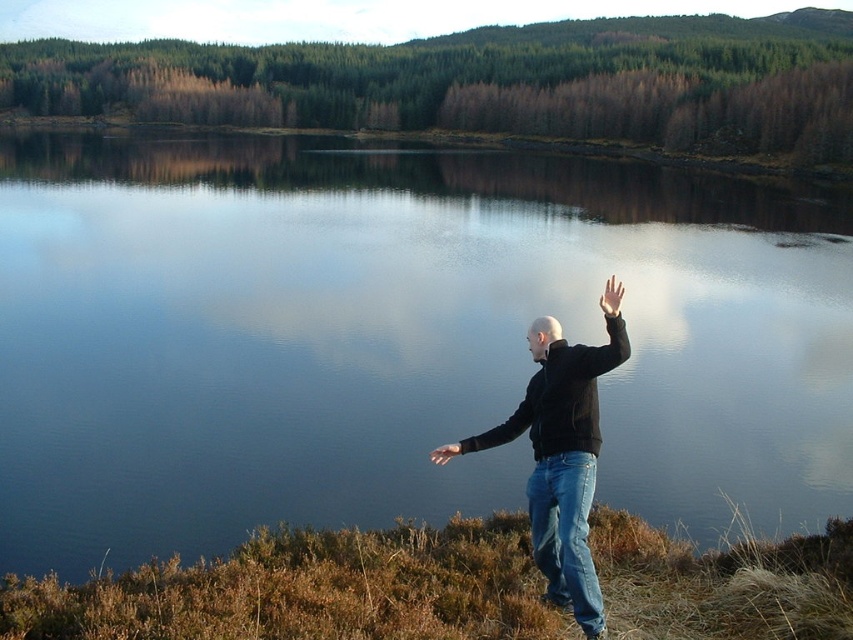
Question: Among these objects, which one is nearest to the camera?

Choices:
 (A) light brown leather hand at center right
 (B) blue reflective water at center

Answer: (A)

Question: Which point appears farthest from the camera in this image?

Choices:
 (A) (10, 252)
 (B) (614, 321)
 (C) (601, 364)

Answer: (A)

Question: Can you confirm if blue reflective water at center is wider than black matte arm at center?

Choices:
 (A) no
 (B) yes

Answer: (B)

Question: In this image, where is black matte arm at right located relative to black matte arm at center?

Choices:
 (A) above
 (B) below

Answer: (A)

Question: Can you confirm if blue reflective water at center is positioned to the left of black matte jacket at center?

Choices:
 (A) no
 (B) yes

Answer: (A)

Question: Which object is positioned closest to the black matte jacket at center?

Choices:
 (A) light brown leather hand at center right
 (B) black matte arm at right
 (C) blue reflective water at center

Answer: (B)